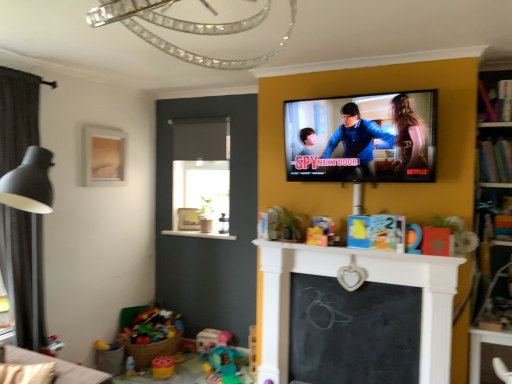
Identify the location of vacant space positioned to the left of plastic teal toy at lower center, the 3th toy when ordered from left to right. (193, 368).